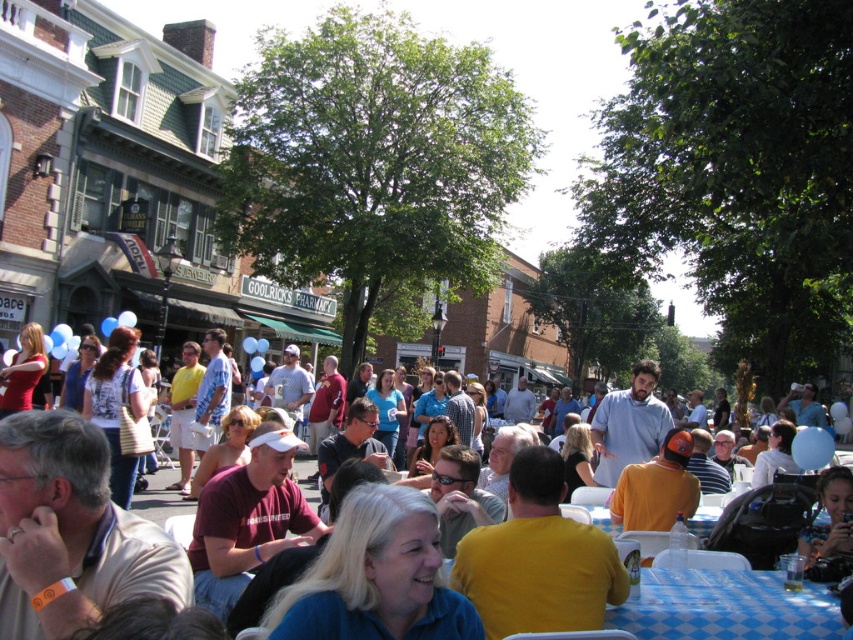
Can you confirm if yellow t-shirt at center is wider than blue checkered tablecloth at lower right?

Yes.

Who is more distant from viewer, (x=817, y=600) or (x=740, y=608)?

Point (x=817, y=600)

This screenshot has width=853, height=640. What are the coordinates of `yellow t-shirt at center` in the screenshot? It's located at (726, 608).